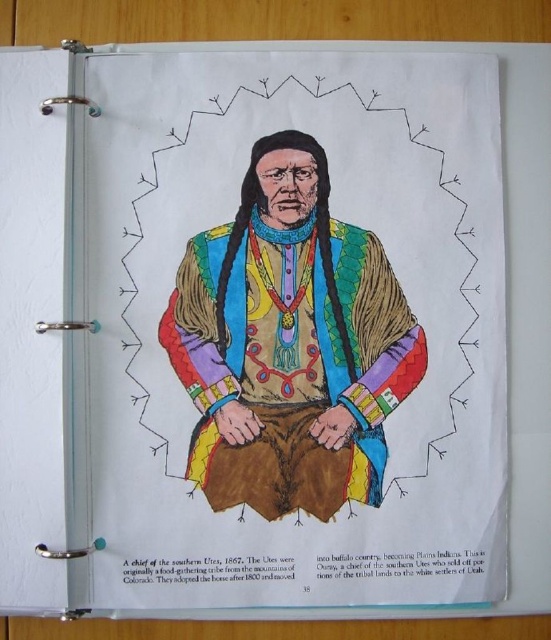
Question: Which object appears farthest from the camera in this image?

Choices:
 (A) black paper at bottom
 (B) multicolored fur vest at center

Answer: (B)

Question: Does multicolored fur vest at center have a lesser width compared to black paper at bottom?

Choices:
 (A) no
 (B) yes

Answer: (A)

Question: Is multicolored fur vest at center positioned in front of black paper at bottom?

Choices:
 (A) no
 (B) yes

Answer: (A)

Question: Is multicolored fur vest at center behind black paper at bottom?

Choices:
 (A) yes
 (B) no

Answer: (A)

Question: Which of the following is the closest to the observer?

Choices:
 (A) black paper at bottom
 (B) multicolored fur vest at center

Answer: (A)